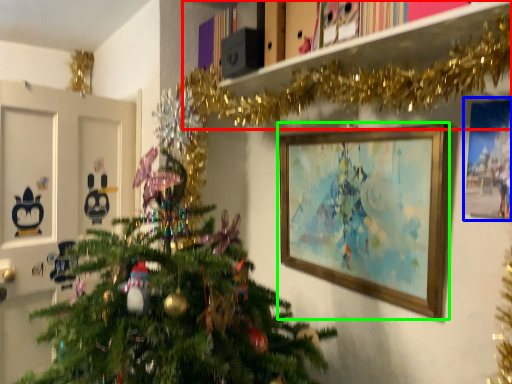
Question: Which object is the farthest from bookshelf (highlighted by a red box)? Choose among these: picture frame (highlighted by a blue box) or picture frame (highlighted by a green box).

Choices:
 (A) picture frame
 (B) picture frame

Answer: (A)